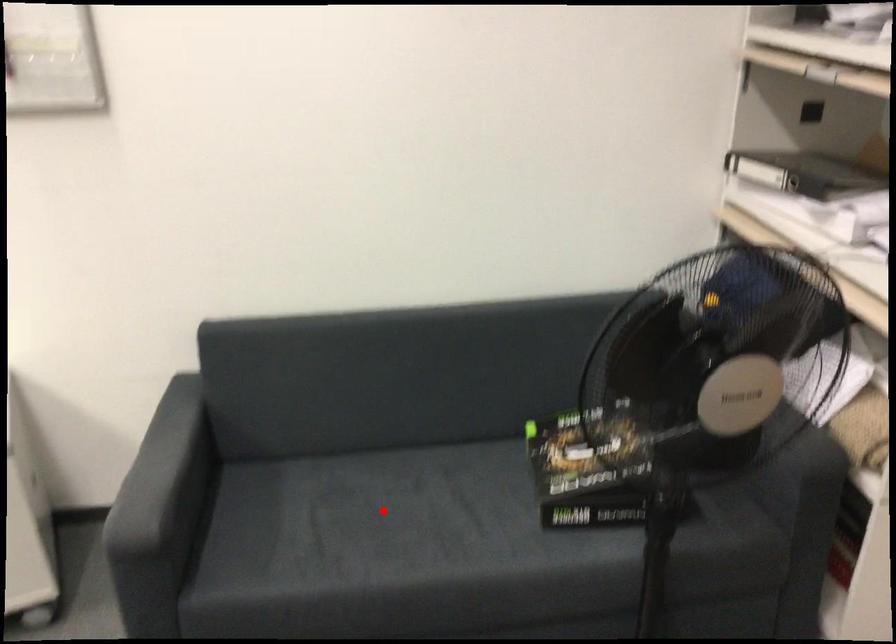
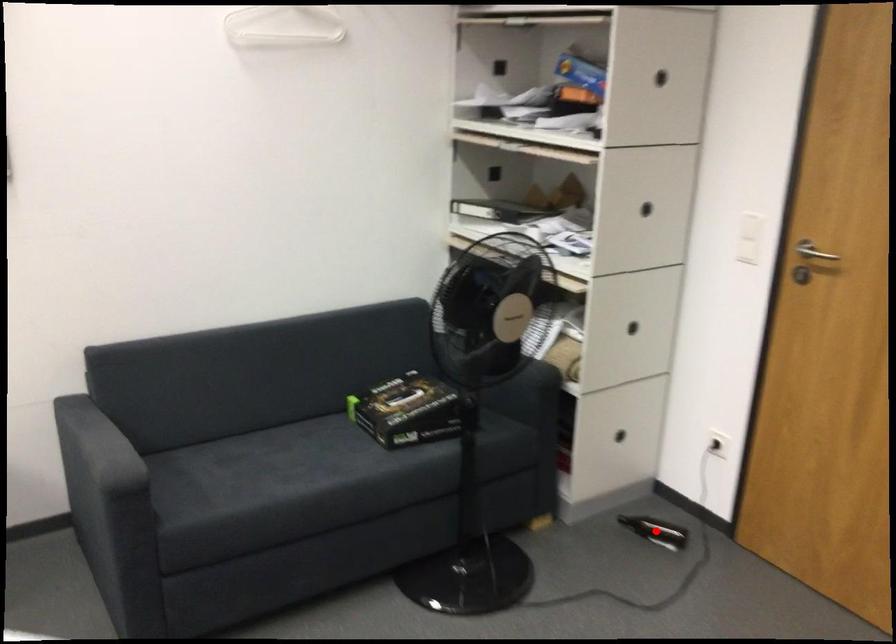
I am providing you with two images of the same scene from different viewpoints. A red point is marked on the first image and another point is marked on the second image. Is the marked point in image1 the same physical position as the marked point in image2?

No